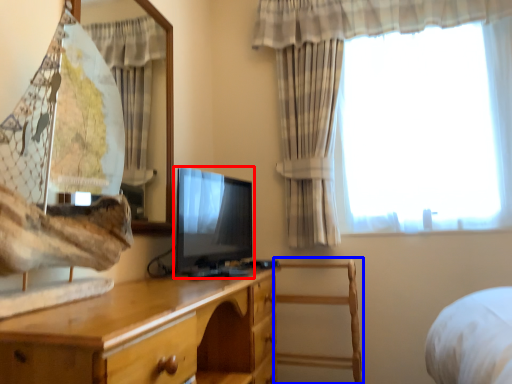
Question: Among these objects, which one is farthest to the camera, television (highlighted by a red box) or chair (highlighted by a blue box)?

Choices:
 (A) television
 (B) chair

Answer: (B)